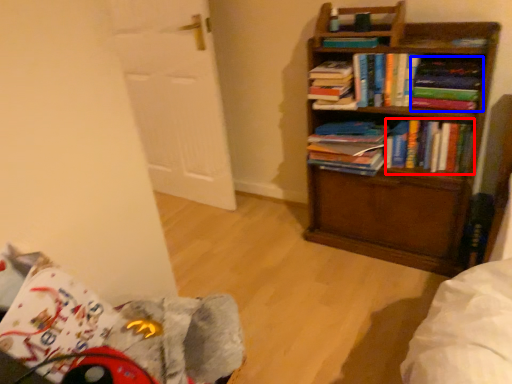
Question: Which object is further to the camera taking this photo, book (highlighted by a red box) or paperback book (highlighted by a blue box)?

Choices:
 (A) book
 (B) paperback book

Answer: (A)